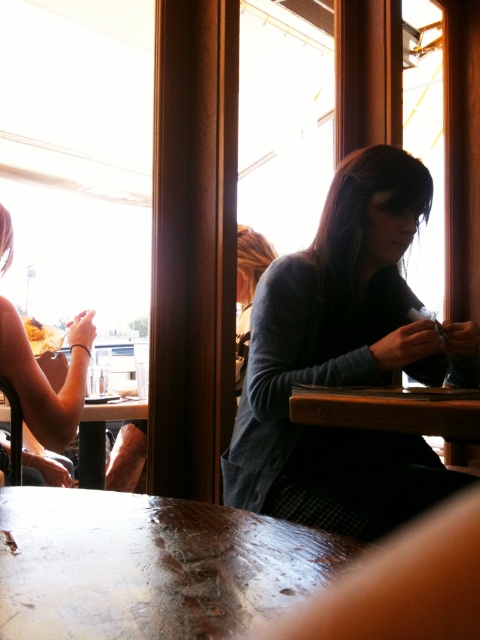
Question: Can you confirm if matte black shirt at left is smaller than wooden table at lower left?

Choices:
 (A) yes
 (B) no

Answer: (B)

Question: Which object is farther from the camera taking this photo?

Choices:
 (A) matte black shirt at left
 (B) gray sweater at center

Answer: (A)

Question: Considering the relative positions of gray sweater at center and wooden table at center in the image provided, where is gray sweater at center located with respect to wooden table at center?

Choices:
 (A) right
 (B) left

Answer: (B)

Question: Estimate the real-world distances between objects in this image. Which object is closer to the wooden table at lower center?

Choices:
 (A) wooden table at lower left
 (B) matte black shirt at left

Answer: (B)

Question: Which point is closer to the camera taking this photo?

Choices:
 (A) (391, 404)
 (B) (68, 625)

Answer: (B)

Question: Is matte black shirt at left wider than wooden table at lower left?

Choices:
 (A) yes
 (B) no

Answer: (B)